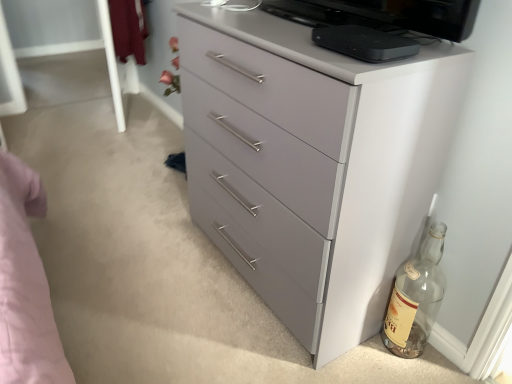
Question: Is point (420, 283) closer or farther from the camera than point (311, 82)?

Choices:
 (A) closer
 (B) farther

Answer: (B)

Question: From their relative heights in the image, would you say transparent glass bottle at lower right is taller or shorter than matte gray chest of drawers at center?

Choices:
 (A) tall
 (B) short

Answer: (B)

Question: Which is farther from the transparent glass bottle at lower right?

Choices:
 (A) black matte device at upper center
 (B) matte gray chest of drawers at center

Answer: (A)

Question: Which is farther from the matte gray chest of drawers at center?

Choices:
 (A) black matte device at upper center
 (B) transparent glass bottle at lower right

Answer: (B)